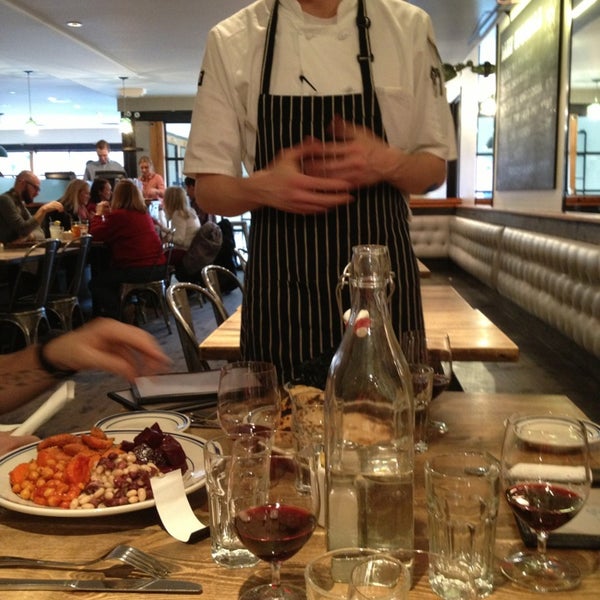
Locate an element on the screen. silverware is located at coordinates (186, 407), (209, 415), (205, 424), (76, 563), (91, 585), (501, 463), (478, 473).